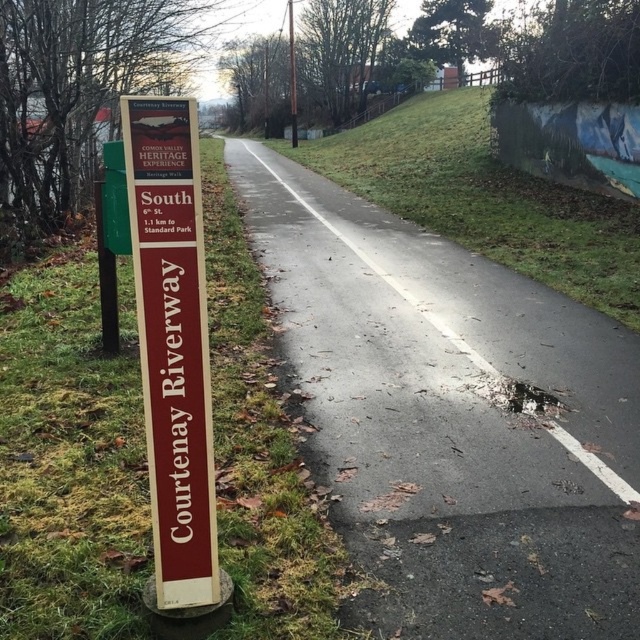
Does green grass at left appear on the left side of green plastic signpost at left?

No, green grass at left is not to the left of green plastic signpost at left.

Between point (260, 604) and point (100, 256), which one is positioned in front?

Point (260, 604) is in front.

At what (x,y) coordinates should I click in order to perform the action: click on green grass at left. Please return your answer as a coordinate pair (x, y). The image size is (640, 640). Looking at the image, I should click on (68, 458).

Measure the distance between green grass at center and maroon wood sign at left.

green grass at center and maroon wood sign at left are 8.35 meters apart.

Describe the element at coordinates (484, 196) in the screenshot. I see `green grass at center` at that location.

Find the location of a particular element. Image resolution: width=640 pixels, height=640 pixels. green grass at center is located at coordinates (484, 196).

Between maroon wood sign at left and green plastic signpost at left, which one is positioned higher?

green plastic signpost at left is above.

Is maroon wood sign at left shorter than green plastic signpost at left?

In fact, maroon wood sign at left may be taller than green plastic signpost at left.

Between point (125, 145) and point (109, 280), which one is positioned behind?

The point (109, 280) is behind.

In order to click on maroon wood sign at left in this screenshot , I will do `click(172, 342)`.